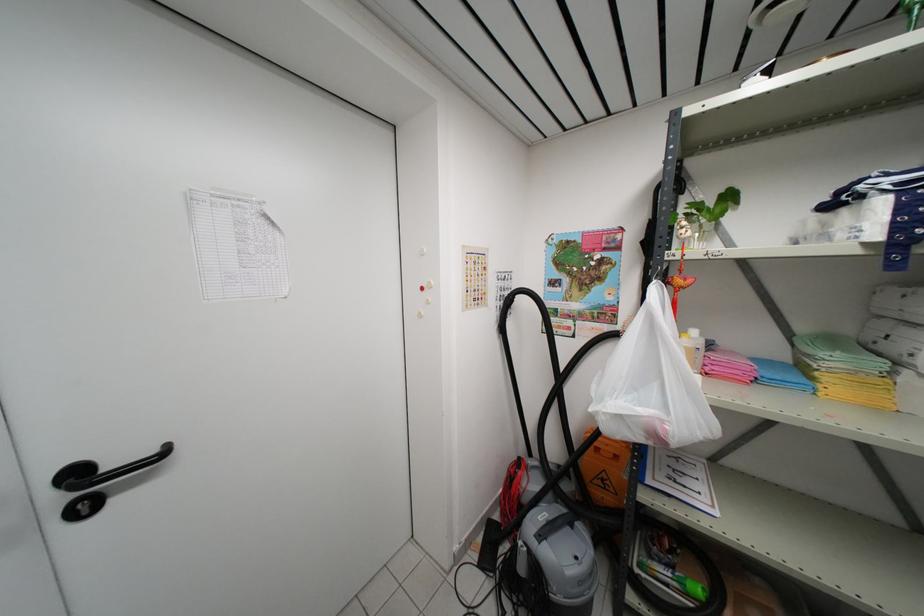
Which object does [782,375] point to?

It refers to a blue binder.